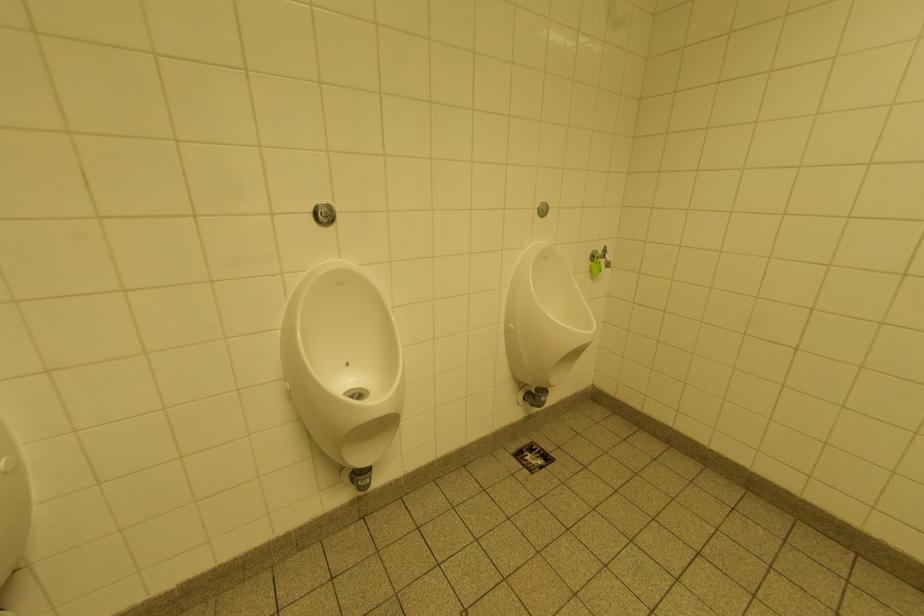
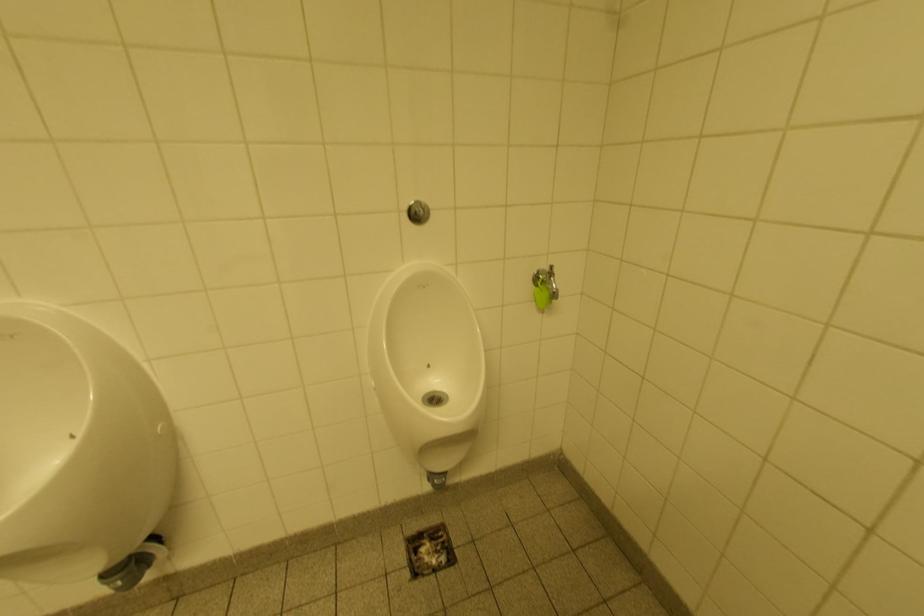
Question: The images are taken continuously from a first-person perspective. In which direction is your viewpoint rotating?

Choices:
 (A) Left
 (B) Right
 (C) Up
 (D) Down

Answer: (A)